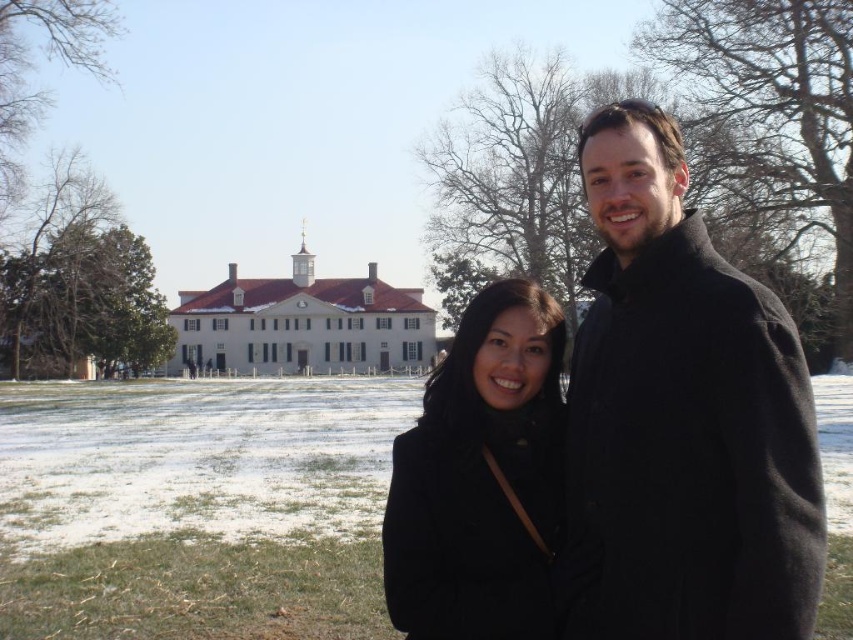
Question: Is black wool coat at right to the right of black matte coat at center from the viewer's perspective?

Choices:
 (A) yes
 (B) no

Answer: (A)

Question: Which point is closer to the camera taking this photo?

Choices:
 (A) (576, 438)
 (B) (433, 426)

Answer: (A)

Question: From the image, what is the correct spatial relationship of black wool coat at right in relation to black matte coat at center?

Choices:
 (A) left
 (B) right

Answer: (B)

Question: Is black wool coat at right closer to the viewer compared to black matte coat at center?

Choices:
 (A) no
 (B) yes

Answer: (B)